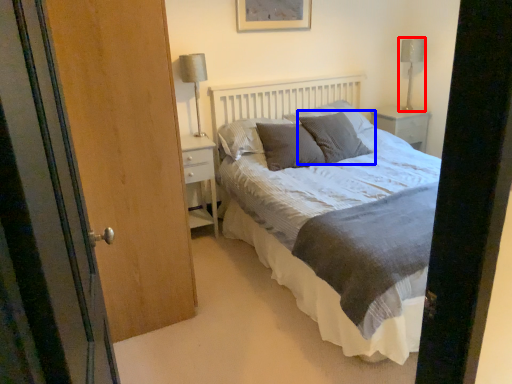
Question: Which object is further to the camera taking this photo, table lamp (highlighted by a red box) or pillow (highlighted by a blue box)?

Choices:
 (A) table lamp
 (B) pillow

Answer: (A)